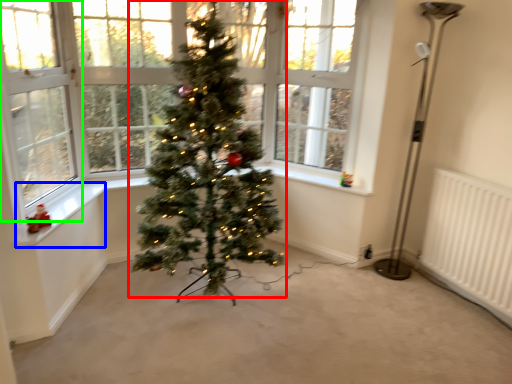
Question: Which is farther away from christmas tree (highlighted by a red box)? window sill (highlighted by a blue box) or window screen (highlighted by a green box)?

Choices:
 (A) window sill
 (B) window screen

Answer: (B)